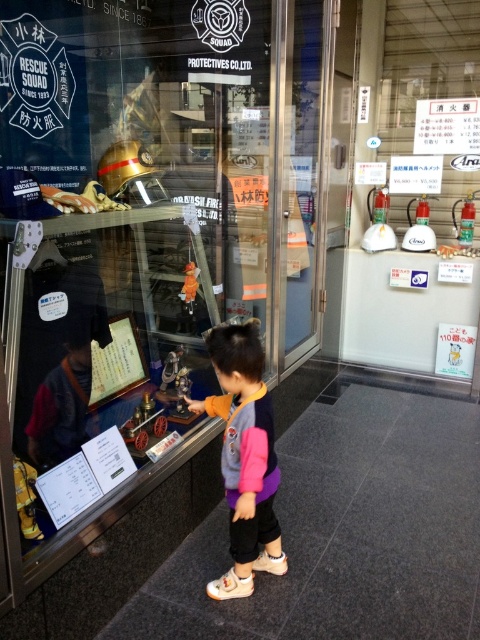
You are a tour guide at the museum and need to ensure that visitors maintain a safe distance of 6 feet from the display case. A child wearing a multicolored fabric jacket at center is currently standing near the case. Can you confirm if the child is within the required distance?

The multicolored fabric jacket at center is currently 5.50 feet away from the viewer, which is within the 6 feet requirement. Therefore, the child is within the safe distance and does not need to move further back.

What are the coordinates of the multicolored fabric jacket at center?

The multicolored fabric jacket at center is located at coordinates point (244, 458).

You are a visitor at the fire station museum and notice the multicolored fabric jacket at center and the wooden plaque at center. Which object is bigger in size?

The multicolored fabric jacket at center is larger in size compared to the wooden plaque at center.